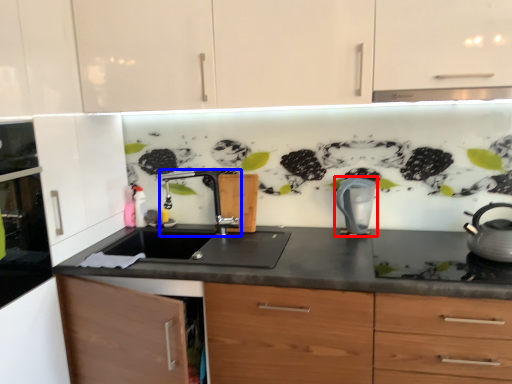
Question: Among these objects, which one is nearest to the camera, kitchen appliance (highlighted by a red box) or tap (highlighted by a blue box)?

Choices:
 (A) kitchen appliance
 (B) tap

Answer: (A)